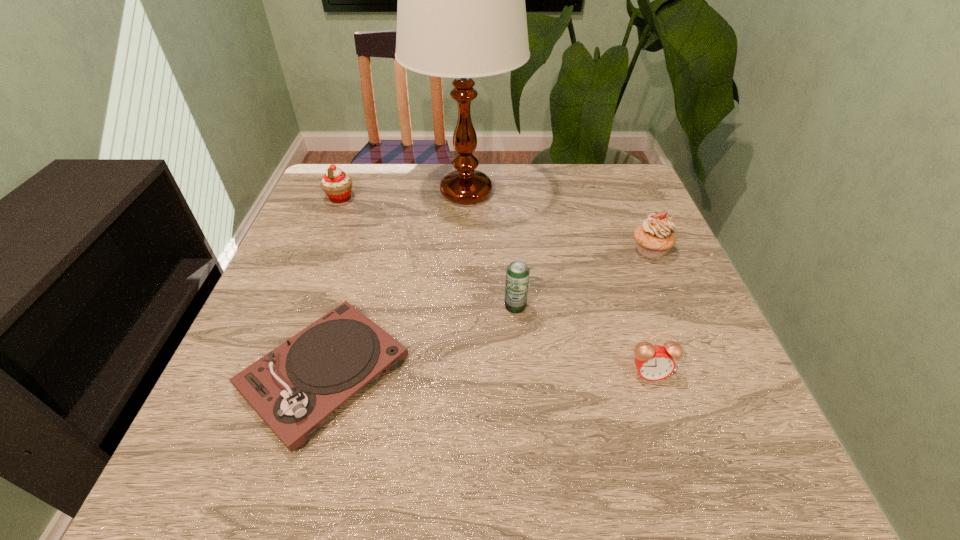
I want to click on object present at the far left corner, so click(337, 185).

Locate an element on the screen. The height and width of the screenshot is (540, 960). object that is at the near left corner is located at coordinates (293, 388).

Locate an element on the screen. This screenshot has height=540, width=960. vacant space at the far edge of the desktop is located at coordinates (447, 169).

Locate an element on the screen. The width and height of the screenshot is (960, 540). vacant space at the near edge is located at coordinates (532, 448).

This screenshot has height=540, width=960. Find the location of `free space at the left edge of the desktop`. free space at the left edge of the desktop is located at coordinates (349, 233).

Image resolution: width=960 pixels, height=540 pixels. I want to click on vacant region at the right edge, so click(x=633, y=226).

In the image, there is a desktop. Find the location of `free region at the far left corner`. free region at the far left corner is located at coordinates (322, 175).

At what (x,y) coordinates should I click in order to perform the action: click on free space at the far right corner. Please return your answer as a coordinate pair (x, y). The image size is (960, 540). Looking at the image, I should click on (633, 207).

You are a GUI agent. You are given a task and a screenshot of the screen. Output one action in this format:
    pyautogui.click(x=<x>, y=<y>)
    Task: Click on the free spot between the nearer cupcake and the shortest object
    
    Given the screenshot: What is the action you would take?
    488,312

Identify the location of free spot between the shortest object and the table lamp. (396, 282).